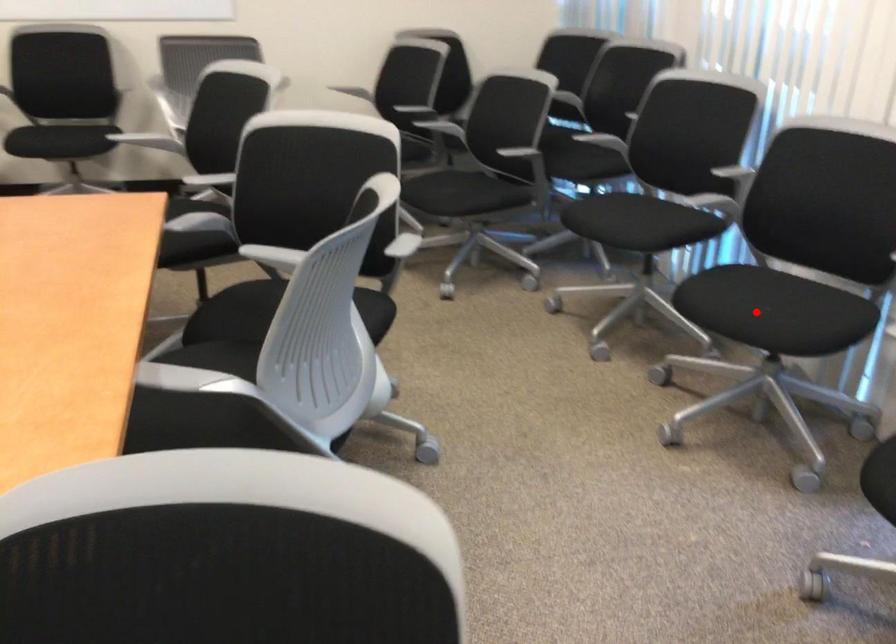
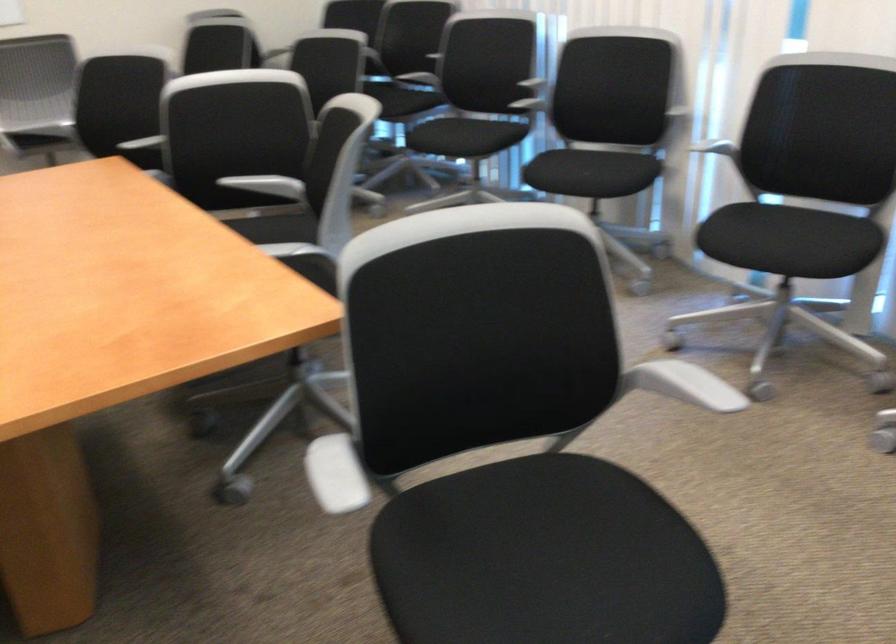
Question: A red point is marked in image1. In image2, is the corresponding 3D point closer to the camera or farther? Reply with the corresponding letter.

Choices:
 (A) The corresponding 3D point is closer.
 (B) The corresponding 3D point is farther.

Answer: (B)